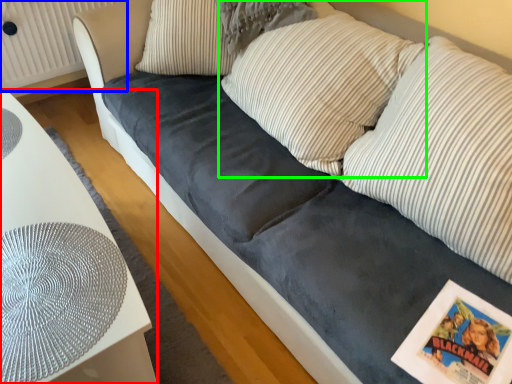
Question: Which object is the closest to the furniture (highlighted by a red box)? Choose among these: radiator (highlighted by a blue box) or pillow (highlighted by a green box).

Choices:
 (A) radiator
 (B) pillow

Answer: (B)